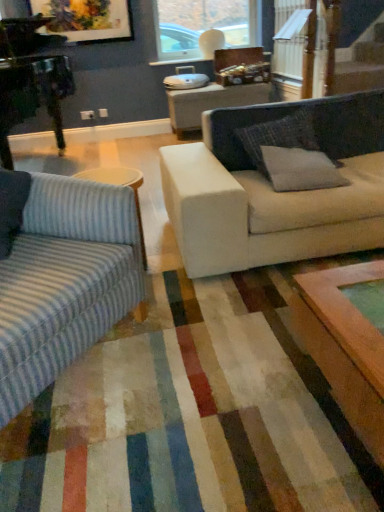
The height and width of the screenshot is (512, 384). What do you see at coordinates (86, 19) in the screenshot?
I see `matte wooden picture frame at upper left` at bounding box center [86, 19].

This screenshot has height=512, width=384. In order to click on transparent glass window at upper center in this screenshot , I will do [204, 26].

The image size is (384, 512). In order to click on gray fabric pillow at right, marked as the first pillow in a front-to-back arrangement in this screenshot , I will do (300, 169).

Image resolution: width=384 pixels, height=512 pixels. I want to click on striped fabric couch at left, so point(64,281).

Where is `matte wooden picture frame at upper left`? matte wooden picture frame at upper left is located at coordinates (86, 19).

Is gray fabric pillow at right, marked as the first pillow in a front-to-back arrangement, facing away from transparent glass window at upper center?

Yes.

From a real-world perspective, is gray fabric pillow at right, which ranks as the second pillow in back-to-front order, on transparent glass window at upper center?

No, from a real-world perspective, gray fabric pillow at right, which ranks as the second pillow in back-to-front order, is not over transparent glass window at upper center

Is gray fabric pillow at right, which ranks as the second pillow in back-to-front order, not close to transparent glass window at upper center?

Yes, gray fabric pillow at right, which ranks as the second pillow in back-to-front order, and transparent glass window at upper center are located far from each other.

Does gray fabric pillow at right, which ranks as the second pillow in back-to-front order, come behind transparent glass window at upper center?

No, gray fabric pillow at right, which ranks as the second pillow in back-to-front order, is closer to the viewer.

Can you confirm if transparent glass window at upper center is thinner than matte wooden picture frame at upper left?

Incorrect, the width of transparent glass window at upper center is not less than that of matte wooden picture frame at upper left.

Between transparent glass window at upper center and matte wooden picture frame at upper left, which one has more height?

With more height is transparent glass window at upper center.

Is transparent glass window at upper center not inside matte wooden picture frame at upper left?

Yes, transparent glass window at upper center is located beyond the bounds of matte wooden picture frame at upper left.

Considering the points (156, 26) and (114, 26), which point is in front, point (156, 26) or point (114, 26)?

The point (114, 26) is more forward.

From the image's perspective, is transparent glass window at upper center beneath striped fabric couch at left?

No.

Does point (228, 44) come closer to viewer compared to point (121, 225)?

No, it is behind (121, 225).

Is transparent glass window at upper center facing away from striped fabric couch at left?

No, striped fabric couch at left is not at the back of transparent glass window at upper center.

Which of these two, transparent glass window at upper center or striped fabric couch at left, is thinner?

Thinner between the two is transparent glass window at upper center.

Where is `studio couch lying below the gray fabric pillow at center, which ranks as the 2th pillow in front-to-back order (from the image's perspective)`? studio couch lying below the gray fabric pillow at center, which ranks as the 2th pillow in front-to-back order (from the image's perspective) is located at coordinates 64,281.

Between striped fabric couch at left and gray fabric pillow at center, placed as the 1th pillow when sorted from back to front, which one has more height?

Standing taller between the two is striped fabric couch at left.

Is point (45, 250) farther from viewer compared to point (286, 126)?

No.

Who is smaller, striped fabric couch at left or gray fabric pillow at center, which ranks as the 2th pillow in front-to-back order?

gray fabric pillow at center, which ranks as the 2th pillow in front-to-back order.

Does striped fabric couch at left have a larger size compared to transparent glass window at upper center?

Yes, striped fabric couch at left is bigger than transparent glass window at upper center.

Locate an element on the screen. window that is on the right side of striped fabric couch at left is located at coordinates (204, 26).

Looking at their sizes, would you say striped fabric couch at left is wider or thinner than transparent glass window at upper center?

striped fabric couch at left is wider than transparent glass window at upper center.

From the image's perspective, which one is positioned higher, gray fabric pillow at center, placed as the 1th pillow when sorted from back to front, or striped fabric couch at left?

gray fabric pillow at center, placed as the 1th pillow when sorted from back to front, appears higher in the image.

How different are the orientations of gray fabric pillow at center, which ranks as the 2th pillow in front-to-back order, and striped fabric couch at left in degrees?

The angular difference between gray fabric pillow at center, which ranks as the 2th pillow in front-to-back order, and striped fabric couch at left is 51.2 degrees.

Is gray fabric pillow at center, placed as the 1th pillow when sorted from back to front, not close to striped fabric couch at left?

Absolutely, gray fabric pillow at center, placed as the 1th pillow when sorted from back to front, is distant from striped fabric couch at left.

From a real-world perspective, does gray fabric pillow at center, which ranks as the 2th pillow in front-to-back order, sit lower than striped fabric couch at left?

No, from a real-world perspective, gray fabric pillow at center, which ranks as the 2th pillow in front-to-back order, is not beneath striped fabric couch at left.

Would you consider striped fabric couch at left to be distant from matte wooden picture frame at upper left?

That's right, there is a large distance between striped fabric couch at left and matte wooden picture frame at upper left.

Which is more distant, [19,242] or [68,4]?

Point [68,4]

From the image's perspective, relative to matte wooden picture frame at upper left, is striped fabric couch at left above or below?

striped fabric couch at left is situated lower than matte wooden picture frame at upper left in the image.

I want to click on window that appears above the gray fabric pillow at right, marked as the first pillow in a front-to-back arrangement (from the image's perspective), so click(204, 26).

You are a GUI agent. You are given a task and a screenshot of the screen. Output one action in this format:
    pyautogui.click(x=<x>, y=<y>)
    Task: Click on the picture frame that is on the left side of transparent glass window at upper center
    This screenshot has width=384, height=512.
    Given the screenshot: What is the action you would take?
    pyautogui.click(x=86, y=19)

When comparing their distances from matte wooden picture frame at upper left, does gray fabric pillow at right, marked as the first pillow in a front-to-back arrangement, or gray fabric pillow at center, placed as the 1th pillow when sorted from back to front, seem further?

Among the two, gray fabric pillow at right, marked as the first pillow in a front-to-back arrangement, is located further to matte wooden picture frame at upper left.

Considering their positions, is matte wooden picture frame at upper left positioned closer to gray fabric pillow at center, placed as the 1th pillow when sorted from back to front, than gray fabric pillow at right, which ranks as the second pillow in back-to-front order?

The object closer to gray fabric pillow at center, placed as the 1th pillow when sorted from back to front, is gray fabric pillow at right, which ranks as the second pillow in back-to-front order.

Which object lies nearer to the anchor point matte wooden picture frame at upper left, striped fabric couch at left or gray fabric pillow at right, marked as the first pillow in a front-to-back arrangement?

gray fabric pillow at right, marked as the first pillow in a front-to-back arrangement, lies closer to matte wooden picture frame at upper left than the other object.

From the image, which object appears to be nearer to striped fabric couch at left, transparent glass window at upper center or gray fabric pillow at center, placed as the 1th pillow when sorted from back to front?

The object closer to striped fabric couch at left is gray fabric pillow at center, placed as the 1th pillow when sorted from back to front.

Looking at this image, looking at the image, which one is located further to matte wooden picture frame at upper left, gray fabric pillow at center, placed as the 1th pillow when sorted from back to front, or transparent glass window at upper center?

The object further to matte wooden picture frame at upper left is gray fabric pillow at center, placed as the 1th pillow when sorted from back to front.

From the picture: Which object lies nearer to the anchor point striped fabric couch at left, matte wooden picture frame at upper left or gray fabric pillow at center, which ranks as the 2th pillow in front-to-back order?

The object closer to striped fabric couch at left is gray fabric pillow at center, which ranks as the 2th pillow in front-to-back order.

Estimate the real-world distances between objects in this image. Which object is closer to transparent glass window at upper center, gray fabric pillow at center, which ranks as the 2th pillow in front-to-back order, or matte wooden picture frame at upper left?

matte wooden picture frame at upper left is closer to transparent glass window at upper center.

Estimate the real-world distances between objects in this image. Which object is further from transparent glass window at upper center, gray fabric pillow at right, marked as the first pillow in a front-to-back arrangement, or gray fabric pillow at center, which ranks as the 2th pillow in front-to-back order?

gray fabric pillow at right, marked as the first pillow in a front-to-back arrangement.

Where is `pillow positioned between gray fabric pillow at right, marked as the first pillow in a front-to-back arrangement, and transparent glass window at upper center from near to far`? This screenshot has height=512, width=384. pillow positioned between gray fabric pillow at right, marked as the first pillow in a front-to-back arrangement, and transparent glass window at upper center from near to far is located at coordinates (278, 137).

The width and height of the screenshot is (384, 512). I want to click on picture frame between gray fabric pillow at right, marked as the first pillow in a front-to-back arrangement, and transparent glass window at upper center, along the z-axis, so click(86, 19).

Identify the location of picture frame between gray fabric pillow at center, which ranks as the 2th pillow in front-to-back order, and transparent glass window at upper center, along the z-axis. This screenshot has width=384, height=512. (86, 19).

Locate an element on the screen. This screenshot has height=512, width=384. picture frame located between striped fabric couch at left and transparent glass window at upper center in the depth direction is located at coordinates (86, 19).